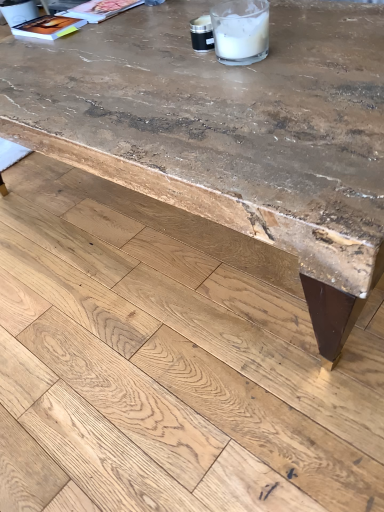
In order to click on vacant space to the left of clear plastic straw at upper center in this screenshot , I will do `click(170, 82)`.